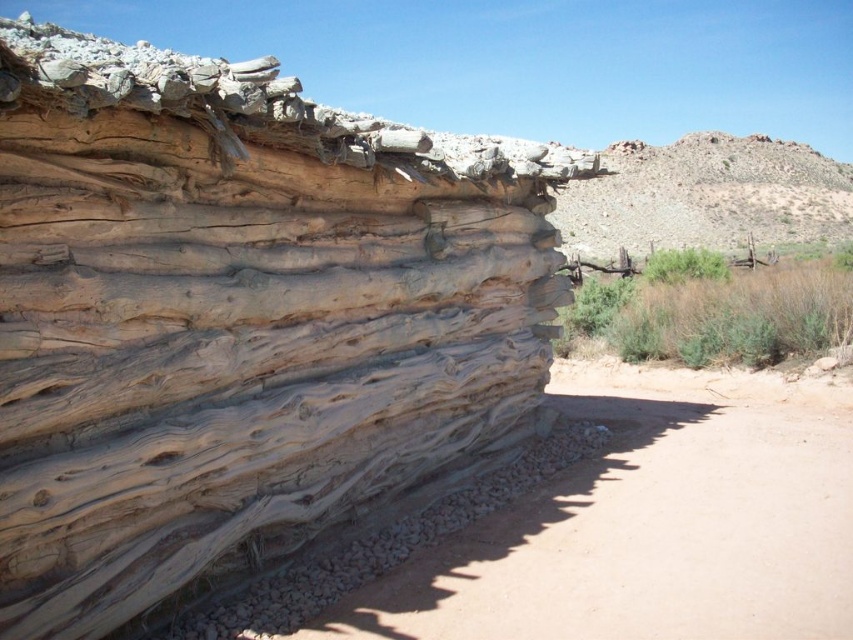
Describe the element at coordinates (241, 323) in the screenshot. I see `smooth beige rock at center` at that location.

Based on the photo, who is taller, smooth beige rock at center or brown dirt track at lower left?

Standing taller between the two is smooth beige rock at center.

Which is in front, point (184, 212) or point (602, 541)?

Point (184, 212) is more forward.

Where is `smooth beige rock at center`? The image size is (853, 640). smooth beige rock at center is located at coordinates (241, 323).